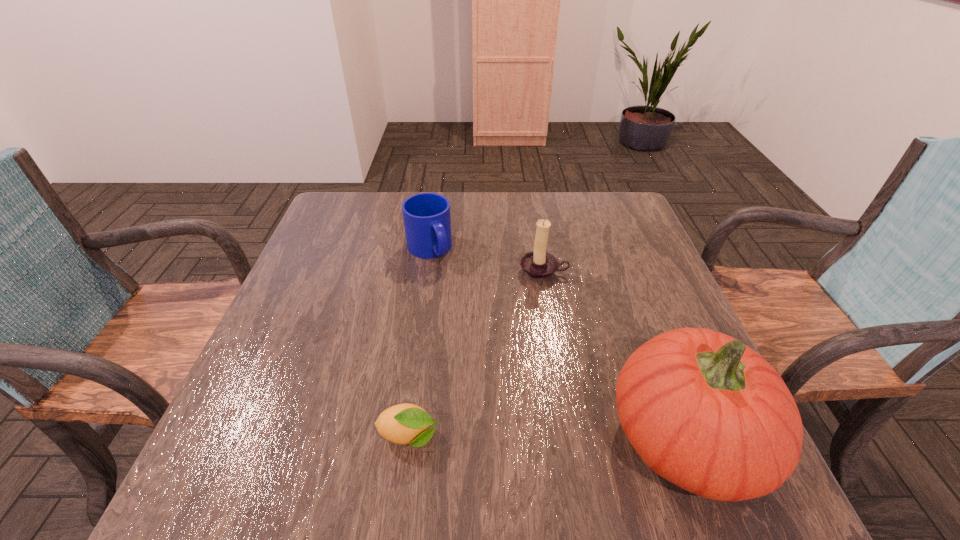
Find the location of `free spot between the candle holder and the second shortest object`. free spot between the candle holder and the second shortest object is located at coordinates (486, 260).

Find the location of a particular element. Image resolution: width=960 pixels, height=540 pixels. free point between the lemon and the third object from left to right is located at coordinates (476, 354).

Identify the location of vacant point located between the lemon and the pumpkin. The width and height of the screenshot is (960, 540). (548, 436).

You are a GUI agent. You are given a task and a screenshot of the screen. Output one action in this format:
    pyautogui.click(x=<x>, y=<y>)
    Task: Click on the unoccupied area between the second tallest object and the mug
    The height and width of the screenshot is (540, 960).
    Given the screenshot: What is the action you would take?
    pyautogui.click(x=486, y=260)

At what (x,y) coordinates should I click in order to perform the action: click on free area in between the second object from right to left and the pumpkin. Please return your answer as a coordinate pair (x, y). Looking at the image, I should click on (615, 354).

Where is `unoccupied area between the shortest object and the rightmost object`? unoccupied area between the shortest object and the rightmost object is located at coordinates (548, 436).

The width and height of the screenshot is (960, 540). Find the location of `the second closest object relative to the mug`. the second closest object relative to the mug is located at coordinates (406, 423).

Choose which object is the nearest neighbor to the second object from right to left. Please provide its 2D coordinates. Your answer should be formatted as a tuple, i.e. [(x, y)], where the tuple contains the x and y coordinates of a point satisfying the conditions above.

[(427, 221)]

The width and height of the screenshot is (960, 540). I want to click on free space in the image that satisfies the following two spatial constraints: 1. on the front side of the candle holder; 2. on the left side of the pumpkin, so click(571, 436).

You are a GUI agent. You are given a task and a screenshot of the screen. Output one action in this format:
    pyautogui.click(x=<x>, y=<y>)
    Task: Click on the free space in the image that satisfies the following two spatial constraints: 1. on the front side of the third tallest object; 2. with leaves positioned above the shortest object
    
    Given the screenshot: What is the action you would take?
    402,437